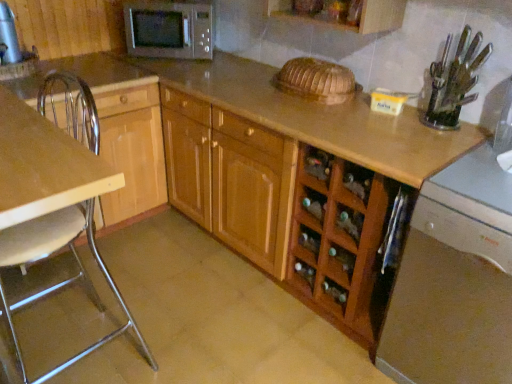
Where is `wooden cabinet at center, placed as the first cabinetry when sorted from right to left`? Image resolution: width=512 pixels, height=384 pixels. wooden cabinet at center, placed as the first cabinetry when sorted from right to left is located at coordinates (283, 209).

At what (x,y) coordinates should I click in order to perform the action: click on satin silver dishwasher at lower right. Please return your answer as a coordinate pair (x, y). Image resolution: width=512 pixels, height=384 pixels. Looking at the image, I should click on (454, 280).

From a real-world perspective, which object stands above the other?

In real-world perspective, brushed metal water heater at upper left, the first appliance positioned from the top, is above.

At what (x,y) coordinates should I click in order to perform the action: click on appliance that is the 1st object located in front of the satin silver microwave at upper center. Please return your answer as a coordinate pair (x, y). The width and height of the screenshot is (512, 384). Looking at the image, I should click on (8, 37).

Which of these two, brushed metal water heater at upper left, the 1th appliance when ordered from back to front, or satin silver microwave at upper center, is smaller?

brushed metal water heater at upper left, the 1th appliance when ordered from back to front, is smaller.

Is wooden cabinet at left, the 1th cabinetry positioned from the left, located within metallic silver chair at left?

That's incorrect, wooden cabinet at left, the 1th cabinetry positioned from the left, is not inside metallic silver chair at left.

Measure the distance between metallic silver chair at left and wooden cabinet at left, positioned as the second cabinetry in right-to-left order.

metallic silver chair at left is 25.78 centimeters from wooden cabinet at left, positioned as the second cabinetry in right-to-left order.

Which is closer to the camera, (46, 233) or (127, 119)?

The point (46, 233) is closer to the camera.

Is metallic silver chair at left aimed at wooden cabinet at left, positioned as the second cabinetry in right-to-left order?

No.

Can brushed metal water heater at upper left, which is the 2th appliance from bottom to top, be found inside wooden cabinet at center, placed as the first cabinetry when sorted from right to left?

No, brushed metal water heater at upper left, which is the 2th appliance from bottom to top, is not inside wooden cabinet at center, placed as the first cabinetry when sorted from right to left.

Which object is thinner, wooden cabinet at center, which is the second cabinetry from left to right, or brushed metal water heater at upper left, the 1th appliance when ordered from back to front?

With smaller width is brushed metal water heater at upper left, the 1th appliance when ordered from back to front.

Between wooden cabinet at center, which is the second cabinetry from left to right, and brushed metal water heater at upper left, which is the 2th appliance from bottom to top, which one appears on the left side from the viewer's perspective?

Positioned to the left is brushed metal water heater at upper left, which is the 2th appliance from bottom to top.

Is metallic silver chair at left bigger than wooden cabinet at center, which is the second cabinetry from left to right?

No, metallic silver chair at left is not bigger than wooden cabinet at center, which is the second cabinetry from left to right.

What's the angular difference between metallic silver chair at left and wooden cabinet at center, which is the second cabinetry from left to right,'s facing directions?

89.8 degrees separate the facing orientations of metallic silver chair at left and wooden cabinet at center, which is the second cabinetry from left to right.

From the image's perspective, is metallic silver chair at left beneath wooden cabinet at center, placed as the first cabinetry when sorted from right to left?

Yes, from the image's perspective, metallic silver chair at left is beneath wooden cabinet at center, placed as the first cabinetry when sorted from right to left.

How much distance is there between metallic silver chair at left and wooden cabinet at center, which is the second cabinetry from left to right?

76.39 centimeters.

Is brushed metal water heater at upper left, which is the first appliance from left to right, directly adjacent to clear plastic knife block at upper right, the 2th appliance in the top-to-bottom sequence?

No, brushed metal water heater at upper left, which is the first appliance from left to right, is not touching clear plastic knife block at upper right, the 2th appliance in the top-to-bottom sequence.

Between brushed metal water heater at upper left, which is the second appliance in front-to-back order, and clear plastic knife block at upper right, the 2th appliance in the top-to-bottom sequence, which one appears on the right side from the viewer's perspective?

Positioned to the right is clear plastic knife block at upper right, the 2th appliance in the top-to-bottom sequence.

From the image's perspective, is brushed metal water heater at upper left, which is the first appliance from left to right, below clear plastic knife block at upper right, the second appliance when ordered from back to front?

No, from the image's perspective, brushed metal water heater at upper left, which is the first appliance from left to right, is not below clear plastic knife block at upper right, the second appliance when ordered from back to front.

Is clear plastic knife block at upper right, marked as the second appliance in a left-to-right arrangement, shorter than wooden cabinet at center, placed as the first cabinetry when sorted from right to left?

Yes.

Looking at this image, can wooden cabinet at center, placed as the first cabinetry when sorted from right to left, be found inside clear plastic knife block at upper right, the 2th appliance in the top-to-bottom sequence?

Definitely not — wooden cabinet at center, placed as the first cabinetry when sorted from right to left, is not inside clear plastic knife block at upper right, the 2th appliance in the top-to-bottom sequence.

From the image's perspective, does clear plastic knife block at upper right, marked as the second appliance in a left-to-right arrangement, appear lower than wooden cabinet at center, placed as the first cabinetry when sorted from right to left?

No, from the image's perspective, clear plastic knife block at upper right, marked as the second appliance in a left-to-right arrangement, is not below wooden cabinet at center, placed as the first cabinetry when sorted from right to left.

Could you tell me if brushed metal water heater at upper left, which is the 2th appliance from bottom to top, is turned towards satin silver dishwasher at lower right?

No, brushed metal water heater at upper left, which is the 2th appliance from bottom to top, is not facing towards satin silver dishwasher at lower right.

This screenshot has width=512, height=384. In order to click on the 2nd appliance behind the satin silver dishwasher at lower right in this screenshot , I will do `click(8, 37)`.

Which is behind, point (1, 38) or point (508, 317)?

The point (1, 38) is more distant.

Which of these two, brushed metal water heater at upper left, the 1th appliance when ordered from back to front, or satin silver dishwasher at lower right, is bigger?

satin silver dishwasher at lower right.

Where is `appliance on the left of satin silver microwave at upper center`? This screenshot has height=384, width=512. appliance on the left of satin silver microwave at upper center is located at coordinates (8, 37).

This screenshot has height=384, width=512. Identify the location of chair that is above the wooden cabinet at left, the 1th cabinetry positioned from the left (from a real-world perspective). (50, 247).

Which object lies nearer to the anchor point satin silver microwave at upper center, wooden cabinet at left, positioned as the second cabinetry in right-to-left order, or wooden cabinet at center, which is the second cabinetry from left to right?

Among the two, wooden cabinet at left, positioned as the second cabinetry in right-to-left order, is located nearer to satin silver microwave at upper center.

Estimate the real-world distances between objects in this image. Which object is further from clear plastic knife block at upper right, marked as the first appliance in a bottom-to-top arrangement, satin silver dishwasher at lower right or brushed metal water heater at upper left, the 1th appliance when ordered from back to front?

brushed metal water heater at upper left, the 1th appliance when ordered from back to front, is further to clear plastic knife block at upper right, marked as the first appliance in a bottom-to-top arrangement.

Estimate the real-world distances between objects in this image. Which object is closer to clear plastic knife block at upper right, the first appliance in the right-to-left sequence, brushed metal water heater at upper left, the 1th appliance when ordered from back to front, or satin silver dishwasher at lower right?

satin silver dishwasher at lower right is positioned closer to the anchor clear plastic knife block at upper right, the first appliance in the right-to-left sequence.

Consider the image. Looking at the image, which one is located closer to clear plastic knife block at upper right, the second appliance when ordered from back to front, wooden cabinet at left, the 1th cabinetry positioned from the left, or satin silver dishwasher at lower right?

satin silver dishwasher at lower right lies closer to clear plastic knife block at upper right, the second appliance when ordered from back to front, than the other object.

Looking at the image, which one is located closer to wooden cabinet at center, which is the second cabinetry from left to right, metallic silver chair at left or clear plastic knife block at upper right, which is the first appliance in front-to-back order?

Based on the image, clear plastic knife block at upper right, which is the first appliance in front-to-back order, appears to be nearer to wooden cabinet at center, which is the second cabinetry from left to right.

Looking at the image, which one is located further to wooden cabinet at left, the 1th cabinetry positioned from the left, clear plastic knife block at upper right, marked as the first appliance in a bottom-to-top arrangement, or brushed metal water heater at upper left, which is the first appliance from left to right?

clear plastic knife block at upper right, marked as the first appliance in a bottom-to-top arrangement, lies further to wooden cabinet at left, the 1th cabinetry positioned from the left, than the other object.

From the picture: Which object lies further to the anchor point clear plastic knife block at upper right, the second appliance when ordered from back to front, satin silver dishwasher at lower right or satin silver microwave at upper center?

The object further to clear plastic knife block at upper right, the second appliance when ordered from back to front, is satin silver microwave at upper center.

Looking at the image, which one is located closer to satin silver microwave at upper center, wooden cabinet at center, placed as the first cabinetry when sorted from right to left, or wooden cabinet at left, positioned as the second cabinetry in right-to-left order?

Based on the image, wooden cabinet at left, positioned as the second cabinetry in right-to-left order, appears to be nearer to satin silver microwave at upper center.

This screenshot has height=384, width=512. I want to click on cabinetry between wooden cabinet at center, placed as the first cabinetry when sorted from right to left, and satin silver microwave at upper center in the front-back direction, so click(117, 129).

I want to click on microwave oven situated between metallic silver chair at left and clear plastic knife block at upper right, the second appliance when ordered from back to front, from left to right, so click(169, 30).

Locate an element on the screen. chair between brushed metal water heater at upper left, which is the 2th appliance from bottom to top, and satin silver dishwasher at lower right is located at coordinates (50, 247).

Identify the location of cabinetry located between metallic silver chair at left and wooden cabinet at center, placed as the first cabinetry when sorted from right to left, in the left-right direction. (117, 129).